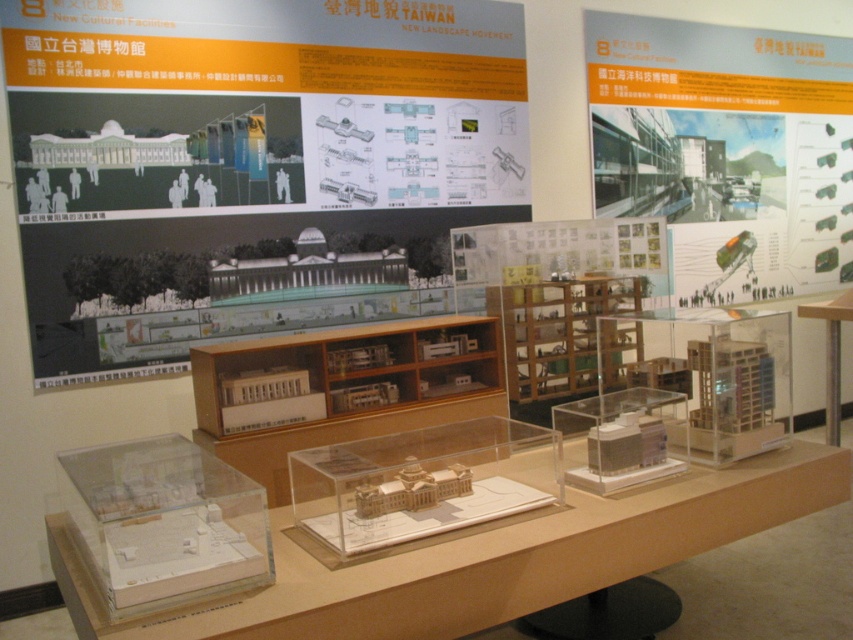
Based on the scene description, where is the clear acrylic table at center located in relation to the clear plastic model at center?

The clear acrylic table at center is to the right of the clear plastic model at center.

Consider the image. You are a visitor at the exhibition and want to take a photo of the matte white building at upper right without the clear acrylic table at center blocking the view. Is there enough space between them to do so?

The matte white building at upper right and the clear acrylic table at center are 9.62 feet apart, so there is sufficient space to take a photo of the matte white building at upper right without the clear acrylic table at center blocking the view.